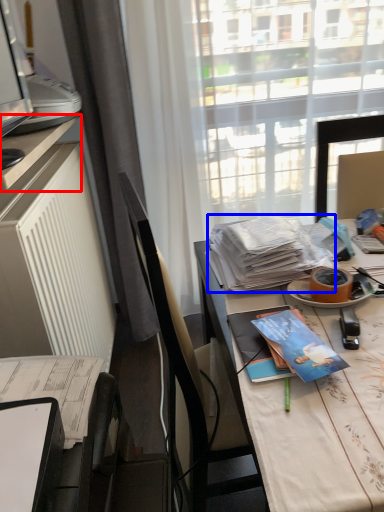
Question: Which object is further to the camera taking this photo, desk (highlighted by a red box) or magazine (highlighted by a blue box)?

Choices:
 (A) desk
 (B) magazine

Answer: (B)